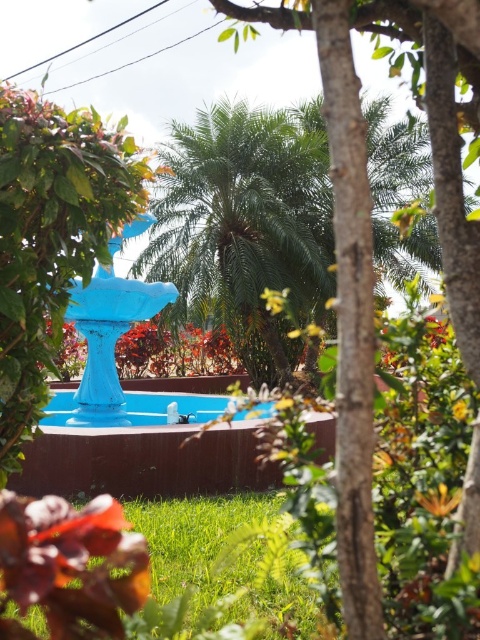
You are a gardener standing in the garden and want to plant a new flower bed between the green leafy palm at center and the blue glossy pool at center. Considering their heights, which object will cast a longer shadow at noon? Please explain your reasoning based on their positions and the sun angle.

The green leafy palm at center is taller than the blue glossy pool at center. Since taller objects generally cast longer shadows when the sun is at a low angle, at noon when the sun is directly overhead, the difference in shadow length would be less pronounced. However, the green leafy palm at center will still cast a slightly longer shadow due to its greater height compared to the blue glossy pool at center.

You are a gardener who needs to water both the green leafy palm at center and the blue glossy pool at center. Your watering can has a range of 5 meters. Can you water both plants without moving the watering can? Explain your reasoning.

The distance between the green leafy palm at center and the blue glossy pool at center is 5.15 meters. Since the watering can has a range of 5 meters, you cannot water both without moving the can because the distance exceeds the canister range.